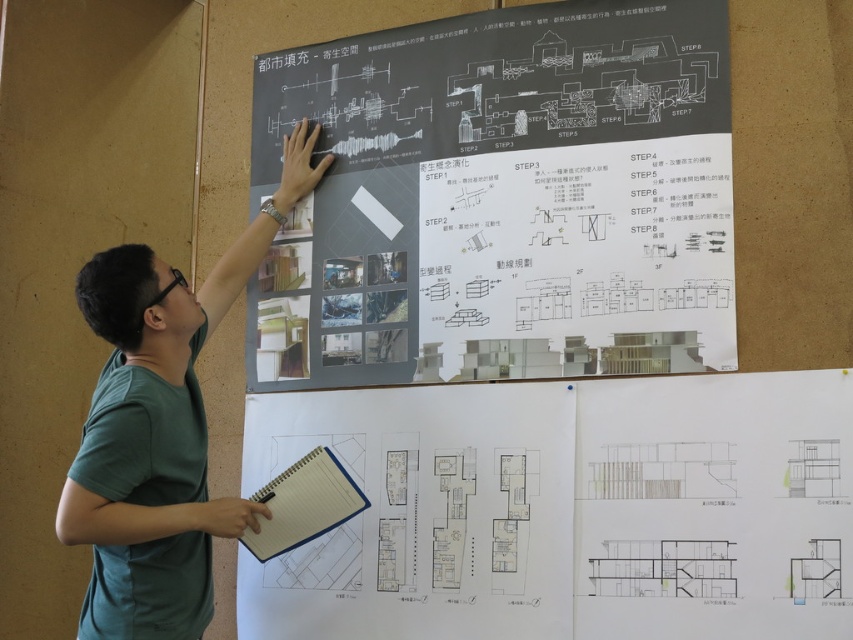
Question: Is gray matte poster at upper center smaller than blue spiral notebook at lower center?

Choices:
 (A) yes
 (B) no

Answer: (B)

Question: Which object is closer to the camera taking this photo?

Choices:
 (A) white paper at lower center
 (B) green t-shirt at upper left

Answer: (A)

Question: Can you confirm if gray matte poster at upper center is positioned to the left of white paper at lower center?

Choices:
 (A) yes
 (B) no

Answer: (A)

Question: Considering the relative positions of gray matte poster at upper center and green t-shirt at upper left in the image provided, where is gray matte poster at upper center located with respect to green t-shirt at upper left?

Choices:
 (A) left
 (B) right

Answer: (B)

Question: Which of these objects is positioned farthest from the green t-shirt at upper left?

Choices:
 (A) white paper at lower center
 (B) blue spiral notebook at lower center
 (C) gray matte poster at upper center

Answer: (A)

Question: Which object is positioned closest to the green t-shirt at upper left?

Choices:
 (A) gray matte poster at upper center
 (B) blue spiral notebook at lower center
 (C) white paper at lower center

Answer: (B)